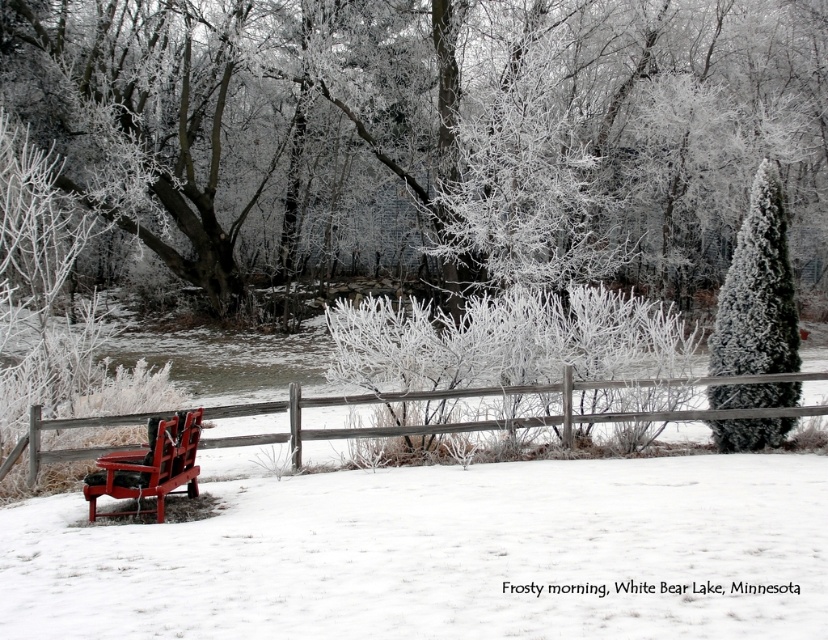
Between wooden at left and matte red park bench at lower left, which one appears on the left side from the viewer's perspective?

Positioned to the left is matte red park bench at lower left.

Who is more forward, (792, 412) or (193, 476)?

Point (193, 476)

Describe the element at coordinates (498, 419) in the screenshot. I see `wooden at left` at that location.

This screenshot has width=828, height=640. I want to click on wooden at left, so click(498, 419).

Can you confirm if wooden at left is positioned above green textured evergreen at right?

No.

Which is behind, point (95, 448) or point (787, 385)?

The point (95, 448) is behind.

At what (x,y) coordinates should I click in order to perform the action: click on wooden at left. Please return your answer as a coordinate pair (x, y). This screenshot has width=828, height=640. Looking at the image, I should click on (498, 419).

Does frosty branches at center appear on the left side of matte red park bench at lower left?

No, frosty branches at center is not to the left of matte red park bench at lower left.

Measure the distance between point (325,4) and camera.

Point (325,4) and camera are 89.58 feet apart.

Locate an element on the screen. This screenshot has width=828, height=640. frosty branches at center is located at coordinates (431, 132).